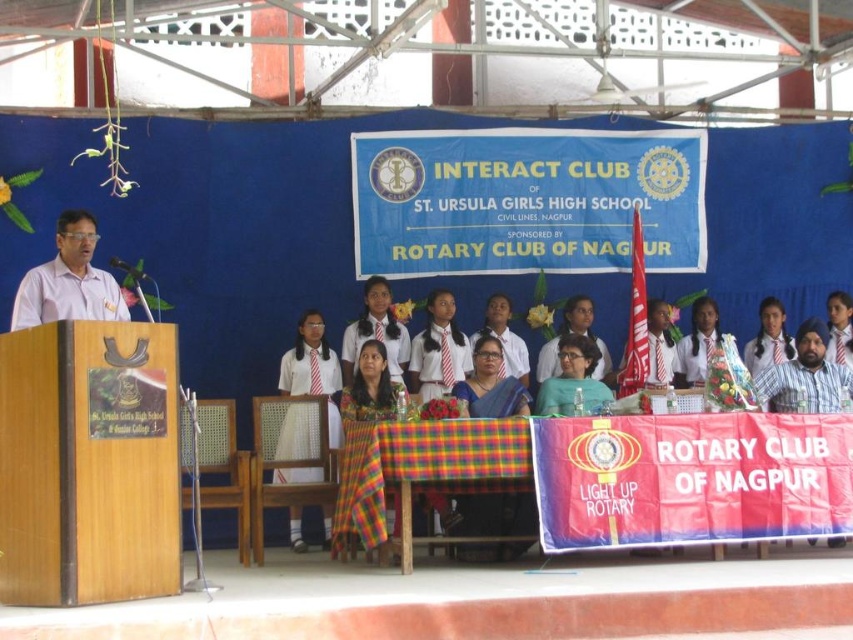
Can you confirm if matte white shirt at left is positioned above satin blue saree at center?

Indeed, matte white shirt at left is positioned over satin blue saree at center.

Identify the location of matte white shirt at left. (68, 280).

Locate an element on the screen. This screenshot has width=853, height=640. matte white uniform at center is located at coordinates (x=375, y=332).

Who is positioned more to the right, matte white uniform at center or matte blue shirt at center?

matte blue shirt at center is more to the right.

What do you see at coordinates (375, 332) in the screenshot? I see `matte white uniform at center` at bounding box center [375, 332].

You are a GUI agent. You are given a task and a screenshot of the screen. Output one action in this format:
    pyautogui.click(x=<x>, y=<y>)
    Task: Click on the matte white uniform at center
    The height and width of the screenshot is (640, 853).
    Given the screenshot: What is the action you would take?
    pyautogui.click(x=375, y=332)

Is white uniform at center thinner than white striped shirt at center?

No, white uniform at center is not thinner than white striped shirt at center.

Which is behind, point (279, 374) or point (791, 340)?

Positioned behind is point (791, 340).

Locate an element on the screen. The height and width of the screenshot is (640, 853). white uniform at center is located at coordinates (309, 360).